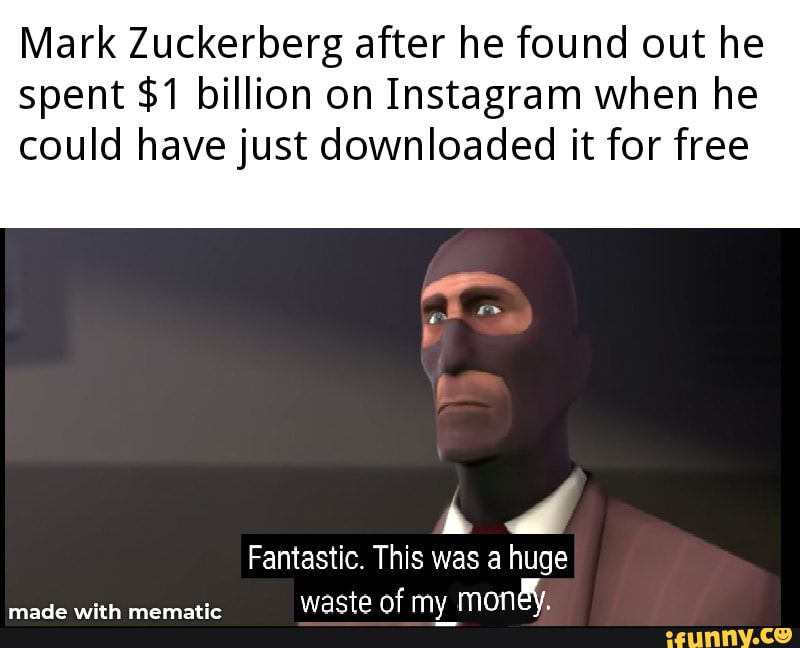
At what (x,y) coordinates should I click in order to perform the action: click on wall. Please return your answer as a coordinate pair (x, y). The height and width of the screenshot is (648, 800). Looking at the image, I should click on (198, 441).